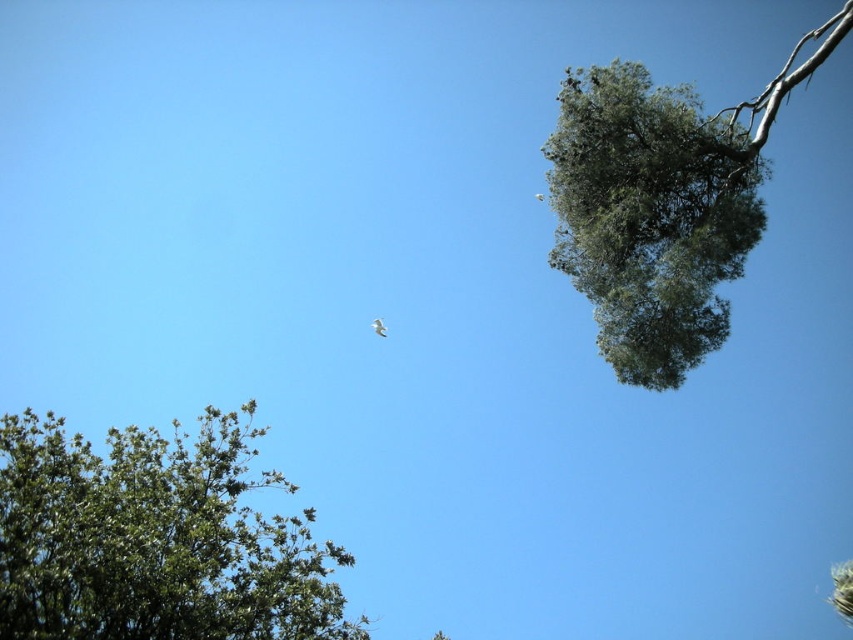
You are a birdwatcher observing the scene. You notice the green leafy tree at lower left and the white feathered bird at upper center. Which object occupies a larger area in the image?

The green leafy tree at lower left has a larger width than the white feathered bird at upper center, so it occupies a larger area in the image.